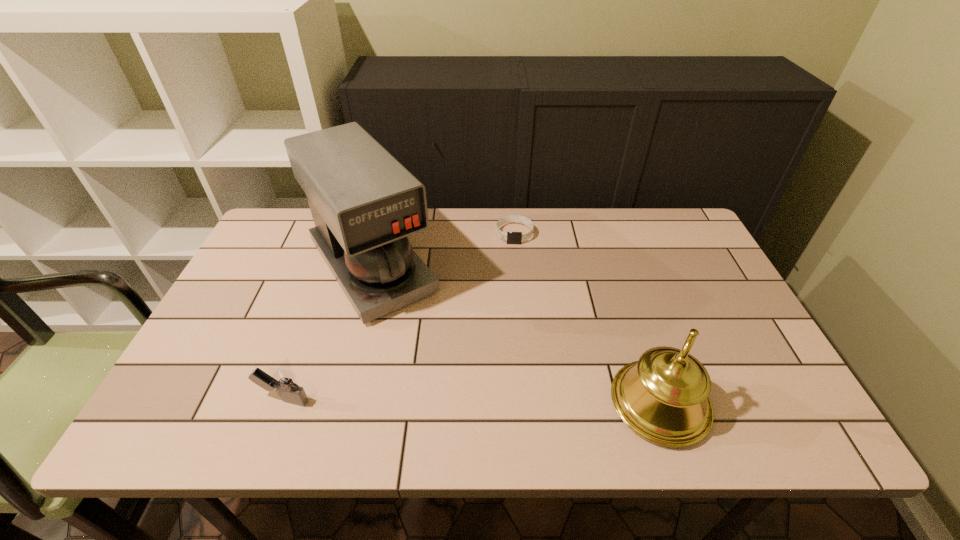
Image resolution: width=960 pixels, height=540 pixels. Find the location of `the third tallest object`. the third tallest object is located at coordinates (283, 380).

This screenshot has height=540, width=960. Find the location of `the third shortest object`. the third shortest object is located at coordinates (663, 397).

Identify the location of the rightmost object. (663, 397).

You are a GUI agent. You are given a task and a screenshot of the screen. Output one action in this format:
    pyautogui.click(x=<x>, y=<y>)
    Task: Click on the tallest object
    This screenshot has height=540, width=960.
    Given the screenshot: What is the action you would take?
    pyautogui.click(x=364, y=203)

You are a GUI agent. You are given a task and a screenshot of the screen. Output one action in this format:
    pyautogui.click(x=<x>, y=<y>)
    Task: Click on the wristband
    Image resolution: width=960 pixels, height=540 pixels.
    Given the screenshot: What is the action you would take?
    pyautogui.click(x=511, y=237)

At what (x,y) coordinates should I click in order to perform the action: click on the second object from right to left. Please return your answer as a coordinate pair (x, y). Looking at the image, I should click on (511, 237).

At what (x,y) coordinates should I click in order to perform the action: click on vacant area situated 0.240m on the back of the igniter. Please return your answer as a coordinate pair (x, y). This screenshot has height=540, width=960. Looking at the image, I should click on (317, 309).

Where is `vacant space located 0.120m on the back of the rightmost object`? The image size is (960, 540). vacant space located 0.120m on the back of the rightmost object is located at coordinates (633, 324).

Locate an element on the screen. free space located on the carafe side of the tallest object is located at coordinates (430, 356).

Where is `free location located on the carafe side of the tallest object`? free location located on the carafe side of the tallest object is located at coordinates (457, 394).